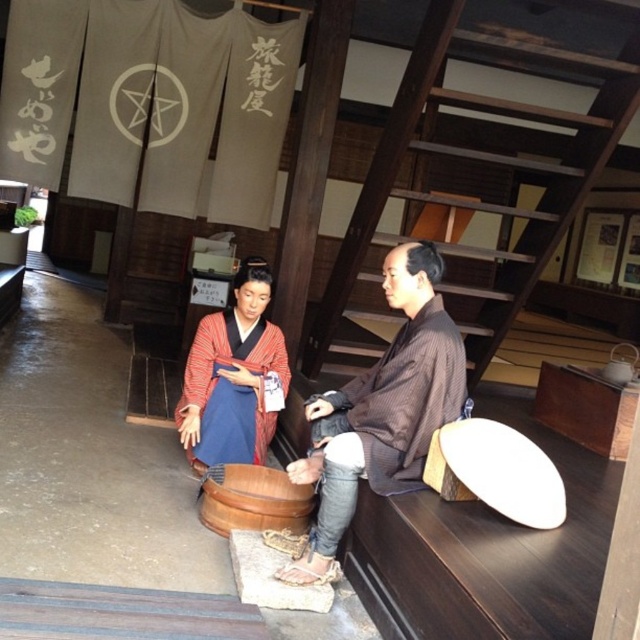
You are a tailor measuring the distance between two kimonos displayed on a bench in a traditional Japanese setting. The kimonos are the brown striped kimono at center and the matte red kimono at center. The tailor needs to know if there is enough space to place a 30 inch long measuring tape between them without moving the kimonos. Can the measuring tape fit between them?

The brown striped kimono at center and the matte red kimono at center are 32.92 inches apart. Since the measuring tape is 30 inches long, it can fit between them as the distance is greater than the tape length.

You are a visitor at this traditional Japanese setting and want to know which kimono is taller between the brown striped kimono at center and the matte red kimono at center. Can you tell me?

The brown striped kimono at center is taller than the matte red kimono at center.